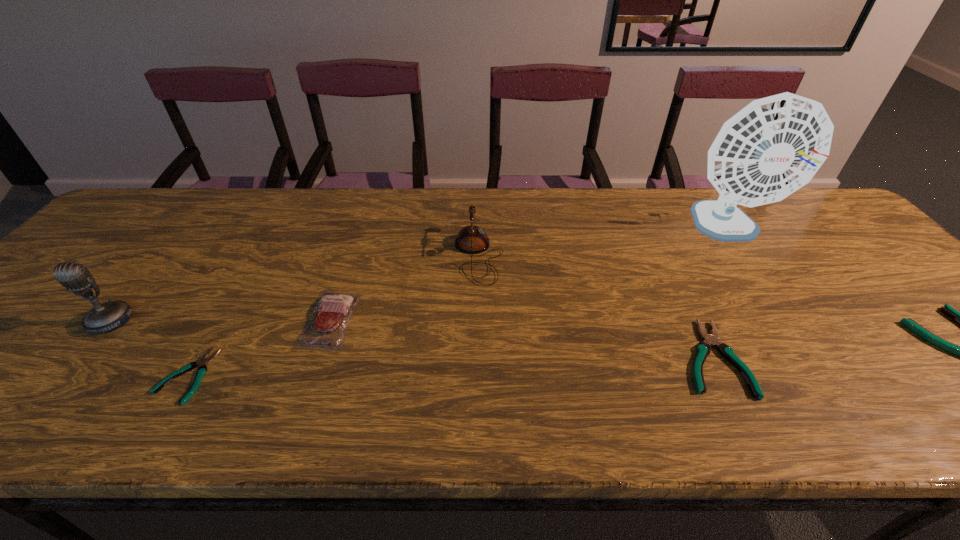
Find the location of a particular element. the fourth tallest object is located at coordinates (326, 329).

Identify the location of steak. coord(326,329).

You are a GUI agent. You are given a task and a screenshot of the screen. Output one action in this format:
    pyautogui.click(x=<x>, y=<y>)
    Task: Click on the vacant area situated on the right of the sixth object from right to left
    The image size is (960, 540).
    Given the screenshot: What is the action you would take?
    pyautogui.click(x=359, y=375)

You are a GUI agent. You are given a task and a screenshot of the screen. Output one action in this format:
    pyautogui.click(x=<x>, y=<y>)
    Task: Click on the vacant area situated on the right of the second pliers from right to left
    
    Given the screenshot: What is the action you would take?
    pyautogui.click(x=876, y=357)

This screenshot has width=960, height=540. I want to click on vacant space situated 0.300m on the grille of the fan, so click(809, 349).

The height and width of the screenshot is (540, 960). What are the coordinates of `vacant space located on the front-facing side of the sixth shortest object` in the screenshot? It's located at (68, 374).

Identify the location of vacant space situated 0.090m on the rotary dial of the fifth shortest object. (537, 256).

Identify the location of free location located 0.340m on the left of the steak. Image resolution: width=960 pixels, height=540 pixels. [158, 319].

Where is `fan that is at the far edge`? The width and height of the screenshot is (960, 540). fan that is at the far edge is located at coordinates (771, 148).

At what (x,y) coordinates should I click in order to perform the action: click on telephone that is positioned at the far edge. Please return your answer as a coordinate pair (x, y). Looking at the image, I should click on (471, 239).